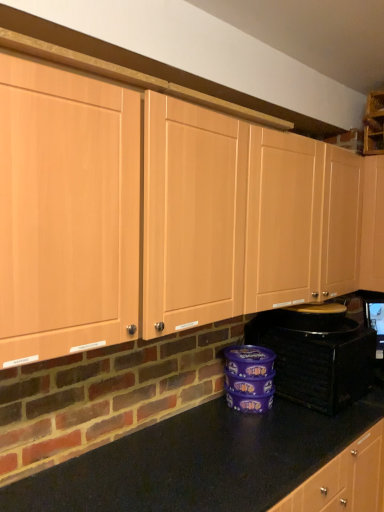
Question: Does black plastic toaster at lower right have a smaller size compared to matte wood cabinets at center?

Choices:
 (A) no
 (B) yes

Answer: (B)

Question: Can you confirm if black plastic toaster at lower right is wider than matte wood cabinets at center?

Choices:
 (A) no
 (B) yes

Answer: (B)

Question: Would you consider black plastic toaster at lower right to be distant from matte wood cabinets at center?

Choices:
 (A) no
 (B) yes

Answer: (A)

Question: Does black plastic toaster at lower right appear on the left side of matte wood cabinets at center?

Choices:
 (A) yes
 (B) no

Answer: (B)

Question: Is the surface of black plastic toaster at lower right in direct contact with matte wood cabinets at center?

Choices:
 (A) yes
 (B) no

Answer: (B)

Question: Considering the relative sizes of black plastic toaster at lower right and matte wood cabinets at center in the image provided, is black plastic toaster at lower right thinner than matte wood cabinets at center?

Choices:
 (A) yes
 (B) no

Answer: (B)

Question: Would you say black plastic toaster at lower right is part of matte wood cabinets at center's contents?

Choices:
 (A) no
 (B) yes

Answer: (A)

Question: Considering the relative sizes of matte wood cabinets at center and black plastic toaster at lower right in the image provided, is matte wood cabinets at center bigger than black plastic toaster at lower right?

Choices:
 (A) yes
 (B) no

Answer: (A)

Question: Is matte wood cabinets at center looking in the opposite direction of black plastic toaster at lower right?

Choices:
 (A) yes
 (B) no

Answer: (B)

Question: From a real-world perspective, is matte wood cabinets at center below black plastic toaster at lower right?

Choices:
 (A) yes
 (B) no

Answer: (B)

Question: Is matte wood cabinets at center taller than black plastic toaster at lower right?

Choices:
 (A) no
 (B) yes

Answer: (B)

Question: From a real-world perspective, does matte wood cabinets at center stand above black plastic toaster at lower right?

Choices:
 (A) yes
 (B) no

Answer: (A)

Question: Is black plastic toaster at lower right in front of or behind matte wood cabinets at center in the image?

Choices:
 (A) behind
 (B) front

Answer: (A)